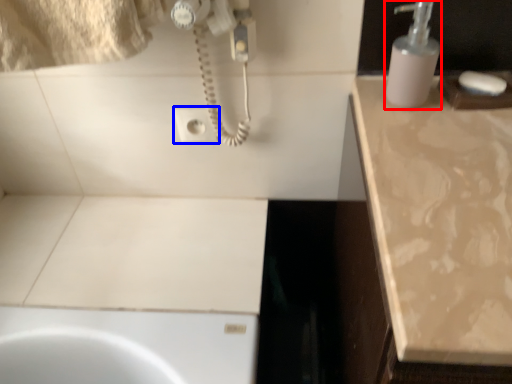
Question: Among these objects, which one is farthest to the camera, soap dispenser (highlighted by a red box) or electric outlet (highlighted by a blue box)?

Choices:
 (A) soap dispenser
 (B) electric outlet

Answer: (B)